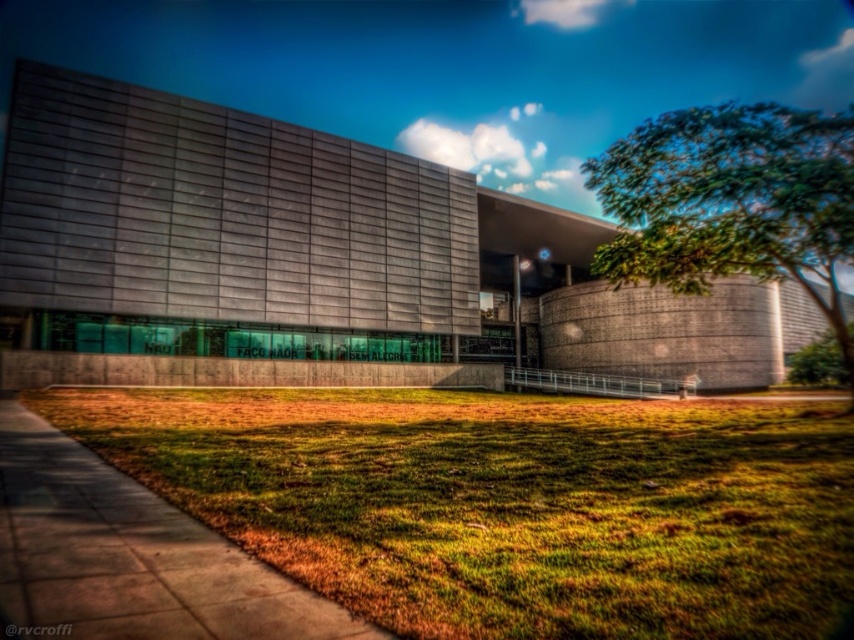
Who is more forward, (838, 541) or (762, 147)?

Positioned in front is point (838, 541).

Who is taller, green grass at lower center or green leafy tree at right?

green leafy tree at right

Is point (630, 419) farther from camera compared to point (788, 195)?

Yes, it is.

Locate an element on the screen. green grass at lower center is located at coordinates (507, 502).